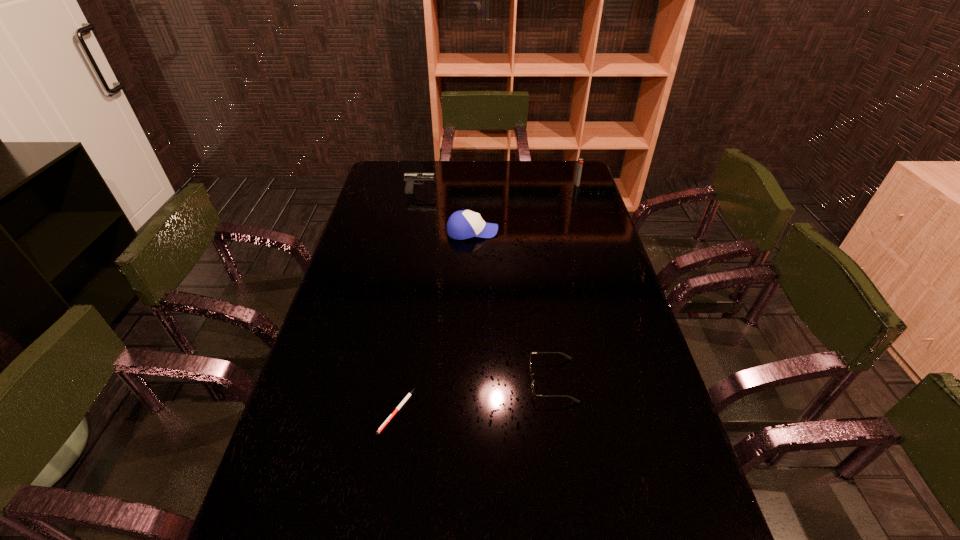
This screenshot has width=960, height=540. Find the location of `the tallest object`. the tallest object is located at coordinates (580, 160).

Find the location of a particular element. the farthest object is located at coordinates (580, 160).

In order to click on pistol in this screenshot , I will do `click(408, 177)`.

At what (x,y) coordinates should I click in order to perform the action: click on the third nearest object. Please return your answer as a coordinate pair (x, y). This screenshot has width=960, height=540. Looking at the image, I should click on (463, 224).

This screenshot has width=960, height=540. I want to click on baseball cap, so click(x=463, y=224).

The height and width of the screenshot is (540, 960). I want to click on the second object from right to left, so click(x=532, y=381).

Where is `the second shortest object`? the second shortest object is located at coordinates (532, 381).

Locate an element on the screen. pen is located at coordinates (406, 398).

Where is `free space located on the left of the igniter`? Image resolution: width=960 pixels, height=540 pixels. free space located on the left of the igniter is located at coordinates (544, 184).

You are a GUI agent. You are given a task and a screenshot of the screen. Output one action in this format:
    pyautogui.click(x=<x>, y=<y>)
    Task: Click on the free spot located aim along the barrel of the second farthest object
    The image size is (960, 540).
    Given the screenshot: What is the action you would take?
    pyautogui.click(x=474, y=192)